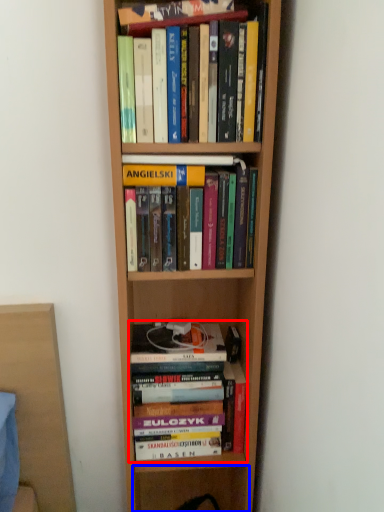
Question: Among these objects, which one is farthest to the camera, book (highlighted by a red box) or shelf (highlighted by a blue box)?

Choices:
 (A) book
 (B) shelf

Answer: (B)